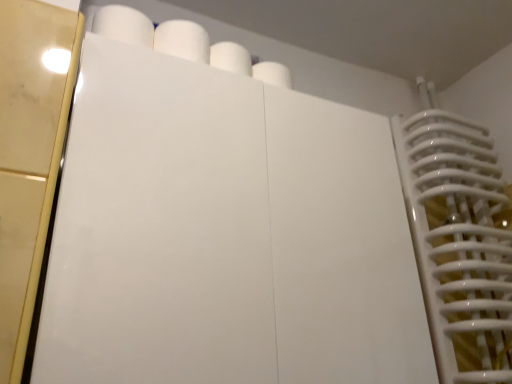
Question: Would you say white glossy door at upper center is inside or outside white matte paper towel at upper center?

Choices:
 (A) inside
 (B) outside

Answer: (B)

Question: Considering the positions of point (189, 142) and point (186, 39), is point (189, 142) closer or farther from the camera than point (186, 39)?

Choices:
 (A) closer
 (B) farther

Answer: (A)

Question: Would you say white glossy door at upper center is to the left or to the right of white matte paper towel at upper center in the picture?

Choices:
 (A) right
 (B) left

Answer: (A)

Question: Is point (192, 48) closer or farther from the camera than point (214, 347)?

Choices:
 (A) farther
 (B) closer

Answer: (A)

Question: Considering the positions of white matte paper towel at upper center and white glossy door at upper center in the image, is white matte paper towel at upper center taller or shorter than white glossy door at upper center?

Choices:
 (A) tall
 (B) short

Answer: (B)

Question: From a real-world perspective, is white matte paper towel at upper center above or below white glossy door at upper center?

Choices:
 (A) above
 (B) below

Answer: (A)

Question: Considering the relative positions of white matte paper towel at upper center and white glossy door at upper center in the image provided, is white matte paper towel at upper center to the left or to the right of white glossy door at upper center?

Choices:
 (A) right
 (B) left

Answer: (B)